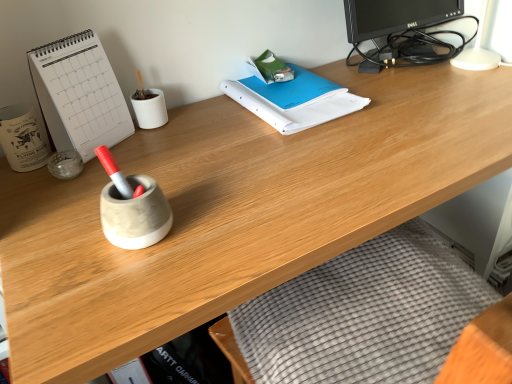
Where is `free spot in front of blue paper binder at center`? This screenshot has width=512, height=384. free spot in front of blue paper binder at center is located at coordinates (310, 159).